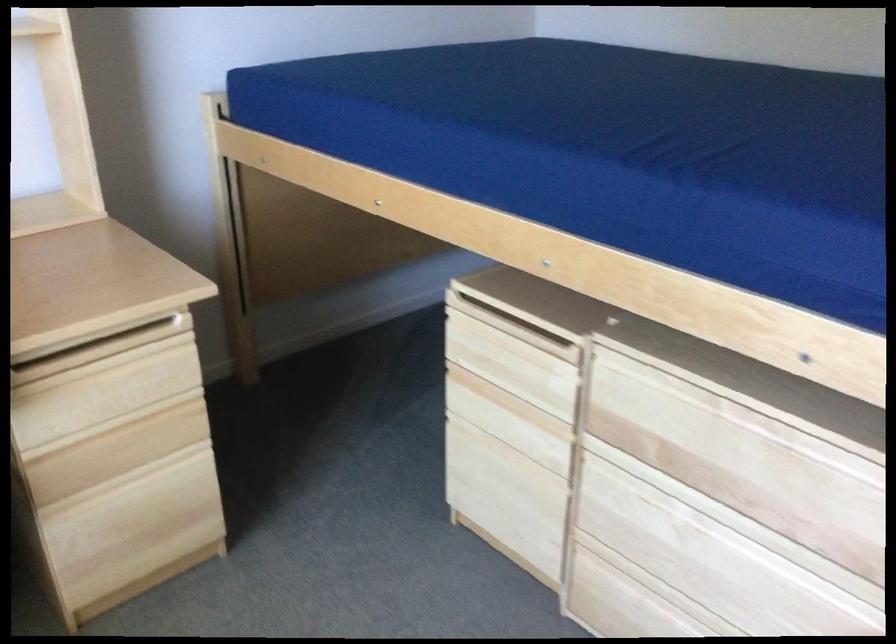
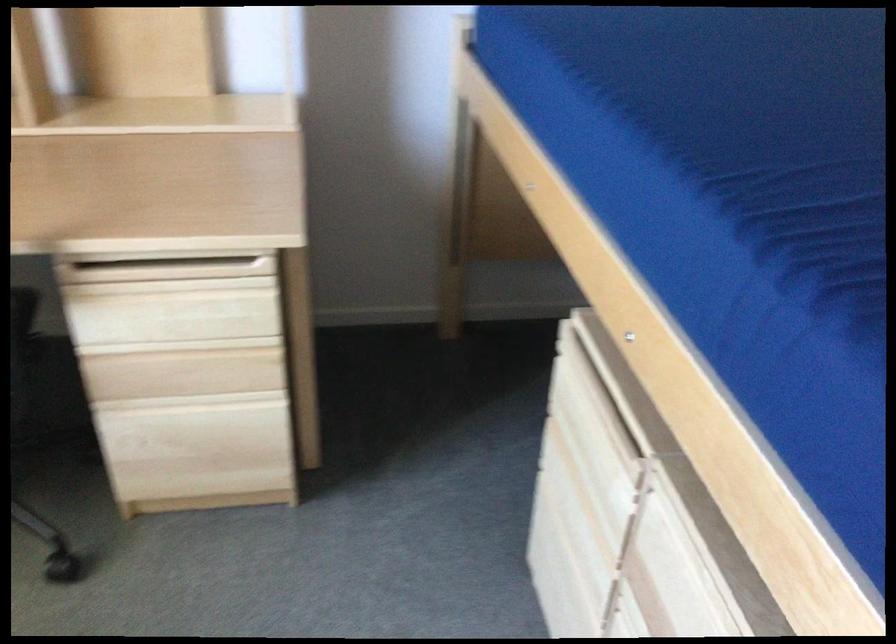
Question: The camera is either moving clockwise (left) or counter-clockwise (right) around the object. The first image is from the beginning of the video and the second image is from the end. Is the camera moving left or right when shooting the video?

Choices:
 (A) Left
 (B) Right

Answer: (B)